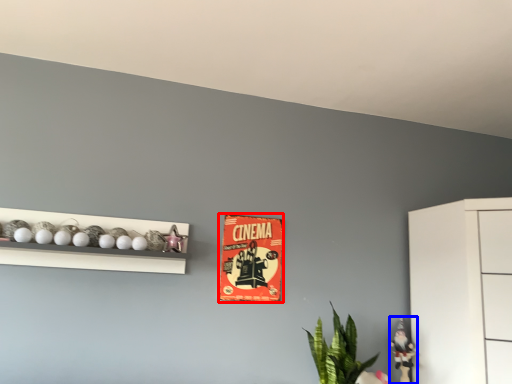
Question: Which of the following is the closest to the observer, postcard (highlighted by a red box) or toy (highlighted by a blue box)?

Choices:
 (A) postcard
 (B) toy

Answer: (B)